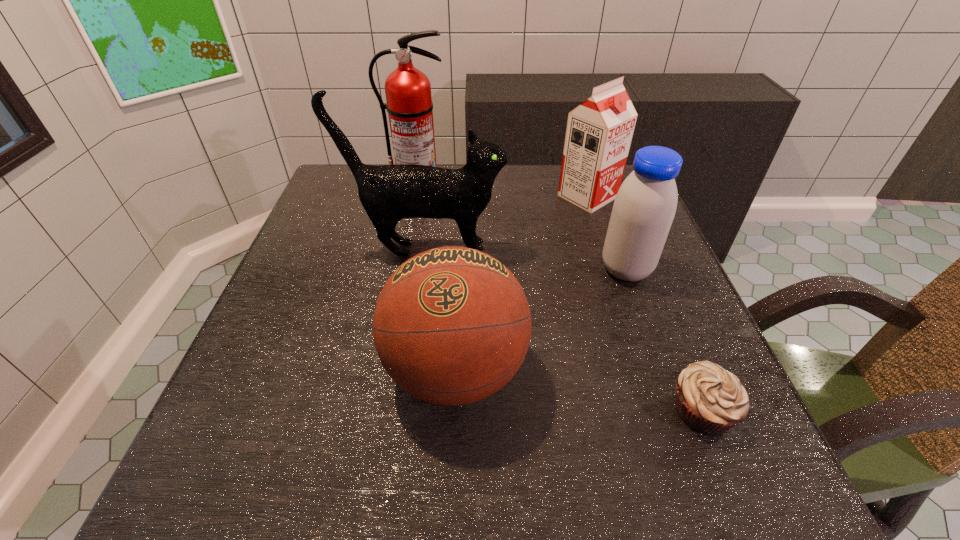
In order to click on free space at the near edge of the desktop in this screenshot , I will do `click(615, 501)`.

The image size is (960, 540). I want to click on vacant region at the left edge of the desktop, so click(245, 354).

Identify the location of vacant space at the right edge. (649, 430).

The width and height of the screenshot is (960, 540). Find the location of `vacant space at the far left corner of the desktop`. vacant space at the far left corner of the desktop is located at coordinates (348, 207).

Identify the location of free region at the far right corner of the desktop. (622, 183).

Image resolution: width=960 pixels, height=540 pixels. In order to click on vacant space at the near right corner in this screenshot , I will do `click(755, 470)`.

Find the location of a particular element. blank region between the nearer soya milk and the fire extinguisher is located at coordinates (521, 227).

Locate an element on the screen. The width and height of the screenshot is (960, 540). free spot between the shortest object and the cat is located at coordinates (564, 330).

I want to click on empty location between the basketball and the farther soya milk, so click(x=521, y=284).

This screenshot has height=540, width=960. I want to click on free space that is in between the shortest object and the basketball, so (x=579, y=390).